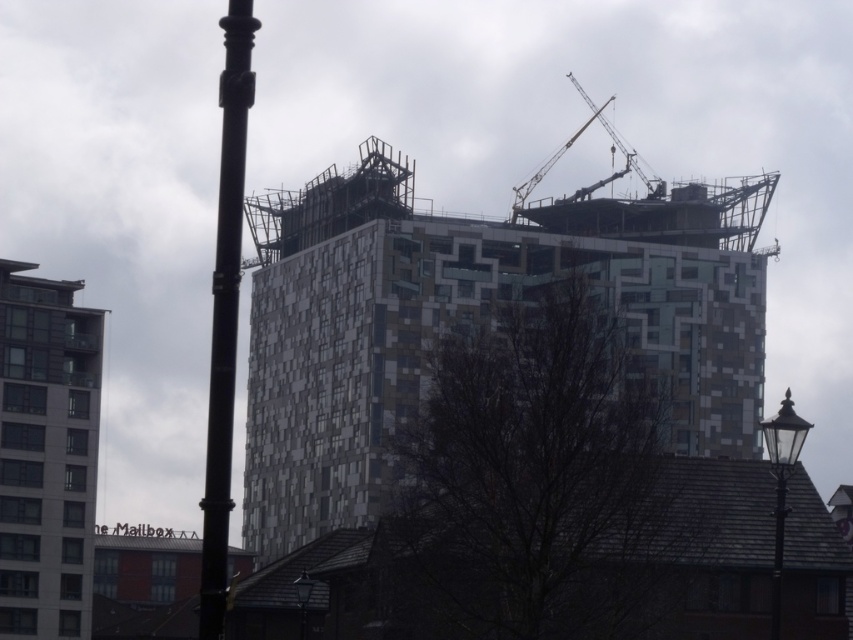
You are a city planner reviewing this urban area. You need to determine if the black metal pole at left and the black glass lamp post at lower center can both be accommodated in a designated space that can only hold objects up to the size of the smaller lamp post. Based on their sizes, will both fit?

The black metal pole at left is larger in size than the black glass lamp post at lower center. Since the designated space can only hold objects up to the size of the smaller lamp post, the larger black metal pole at left will not fit, but the black glass lamp post at lower center will.

You are a city planner reviewing this urban scene. The black metal pole at left is part of the city infrastructure. Based on its position, can you determine if it is closer to the modern construction site or the traditional building in the foreground?

The black metal pole at left is located at point (225, 312), which places it closer to the traditional building in the foreground rather than the modern construction site.

From the picture: You are a city planner who needs to install a new emergency exit sign between the geometric mosaic building at center and the black glass lamp post at lower right. The sign requires a clear space of 300 feet between the two structures to be effective. Based on the scene, will the required distance be sufficient?

The distance between the geometric mosaic building at center and the black glass lamp post at lower right is 332.44 feet, which exceeds the required 300 feet. Therefore, the emergency exit sign will have sufficient space to be effective.